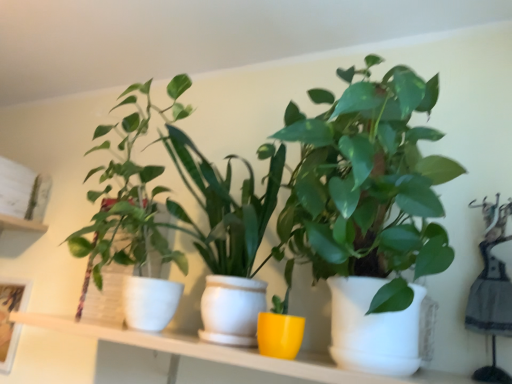
The width and height of the screenshot is (512, 384). What are the coordinates of `green matte plant at center, which is the first houseplant in right-to-left order` in the screenshot? It's located at (334, 190).

Where is `white ceramic shelf at center`? Image resolution: width=512 pixels, height=384 pixels. white ceramic shelf at center is located at coordinates (227, 352).

You are a GUI agent. You are given a task and a screenshot of the screen. Output one action in this format:
    pyautogui.click(x=<x>, y=<y>)
    Task: Click on the woven basket plant at left, the 1th houseplant viewed from the left
    The image size is (512, 384).
    Given the screenshot: What is the action you would take?
    pyautogui.click(x=128, y=196)

Locate an element on the screen. The width and height of the screenshot is (512, 384). green matte plant at center, which is the first houseplant in right-to-left order is located at coordinates (334, 190).

Considering the relative positions of white ceramic shelf at center and green matte plant at center, which is the 2th houseplant from left to right, in the image provided, is white ceramic shelf at center to the left or to the right of green matte plant at center, which is the 2th houseplant from left to right,?

From the image, it's evident that white ceramic shelf at center is to the left of green matte plant at center, which is the 2th houseplant from left to right.

Is white ceramic shelf at center placed right next to green matte plant at center, which is the first houseplant in right-to-left order?

white ceramic shelf at center and green matte plant at center, which is the first houseplant in right-to-left order, are clearly separated.

The height and width of the screenshot is (384, 512). What are the coordinates of `window sill behind the green matte plant at center, which is the first houseplant in right-to-left order` in the screenshot? It's located at (227, 352).

Locate an element on the screen. The image size is (512, 384). houseplant above the woven basket plant at left, the 1th houseplant viewed from the left (from a real-world perspective) is located at coordinates (334, 190).

Between green matte plant at center, which is the 2th houseplant from left to right, and woven basket plant at left, placed as the second houseplant when sorted from right to left, which one is positioned behind?

woven basket plant at left, placed as the second houseplant when sorted from right to left, is behind.

Is green matte plant at center, which is the first houseplant in right-to-left order, beside woven basket plant at left, the 1th houseplant viewed from the left?

No, green matte plant at center, which is the first houseplant in right-to-left order, is not making contact with woven basket plant at left, the 1th houseplant viewed from the left.

Can you tell me how much green matte plant at center, which is the 2th houseplant from left to right, and woven basket plant at left, the 1th houseplant viewed from the left, differ in facing direction?

They differ by 5.11 degrees in their facing directions.

From a real-world perspective, relative to white ceramic shelf at center, is green matte plant at center, which is the 2th houseplant from left to right, vertically above or below?

Clearly, from a real-world perspective, green matte plant at center, which is the 2th houseplant from left to right, is above white ceramic shelf at center.

I want to click on window sill directly beneath the green matte plant at center, which is the first houseplant in right-to-left order (from a real-world perspective), so coord(227,352).

Is green matte plant at center, which is the 2th houseplant from left to right, touching white ceramic shelf at center?

No.

Is green matte plant at center, which is the first houseplant in right-to-left order, wider or thinner than white ceramic shelf at center?

Considering their sizes, green matte plant at center, which is the first houseplant in right-to-left order, looks broader than white ceramic shelf at center.

Relative to white ceramic shelf at center, is woven basket plant at left, the 1th houseplant viewed from the left, in front or behind?

Visually, woven basket plant at left, the 1th houseplant viewed from the left, is located behind white ceramic shelf at center.

Is point (92, 242) positioned behind point (230, 354)?

Yes, it is behind point (230, 354).

Does woven basket plant at left, placed as the second houseplant when sorted from right to left, have a smaller size compared to white ceramic shelf at center?

Yes.

Who is taller, woven basket plant at left, the 1th houseplant viewed from the left, or white ceramic shelf at center?

woven basket plant at left, the 1th houseplant viewed from the left.

Is woven basket plant at left, placed as the second houseplant when sorted from right to left, turned away from green matte plant at center, which is the 2th houseplant from left to right?

woven basket plant at left, placed as the second houseplant when sorted from right to left, is not turned away from green matte plant at center, which is the 2th houseplant from left to right.

Considering the sizes of woven basket plant at left, the 1th houseplant viewed from the left, and green matte plant at center, which is the first houseplant in right-to-left order, in the image, is woven basket plant at left, the 1th houseplant viewed from the left, taller or shorter than green matte plant at center, which is the first houseplant in right-to-left order,?

In the image, woven basket plant at left, the 1th houseplant viewed from the left, appears to be shorter than green matte plant at center, which is the first houseplant in right-to-left order.

What's the angular difference between woven basket plant at left, the 1th houseplant viewed from the left, and green matte plant at center, which is the 2th houseplant from left to right,'s facing directions?

5.11 degrees.

Which is more to the right, white ceramic shelf at center or woven basket plant at left, placed as the second houseplant when sorted from right to left?

white ceramic shelf at center.

Is white ceramic shelf at center beside woven basket plant at left, placed as the second houseplant when sorted from right to left?

No, white ceramic shelf at center is not next to woven basket plant at left, placed as the second houseplant when sorted from right to left.

Considering the relative sizes of white ceramic shelf at center and woven basket plant at left, placed as the second houseplant when sorted from right to left, in the image provided, is white ceramic shelf at center taller than woven basket plant at left, placed as the second houseplant when sorted from right to left,?

In fact, white ceramic shelf at center may be shorter than woven basket plant at left, placed as the second houseplant when sorted from right to left.

Where is `houseplant located on the left of white ceramic shelf at center`? houseplant located on the left of white ceramic shelf at center is located at coordinates (128, 196).

Find the location of a particular element. This screenshot has width=512, height=384. window sill located below the green matte plant at center, which is the 2th houseplant from left to right (from the image's perspective) is located at coordinates (227, 352).

This screenshot has width=512, height=384. Identify the location of houseplant in front of the woven basket plant at left, the 1th houseplant viewed from the left. (334, 190).

Based on their spatial positions, is white ceramic shelf at center or woven basket plant at left, the 1th houseplant viewed from the left, closer to green matte plant at center, which is the 2th houseplant from left to right?

woven basket plant at left, the 1th houseplant viewed from the left, is closer to green matte plant at center, which is the 2th houseplant from left to right.

Looking at the image, which one is located closer to woven basket plant at left, placed as the second houseplant when sorted from right to left, white ceramic shelf at center or green matte plant at center, which is the 2th houseplant from left to right?

green matte plant at center, which is the 2th houseplant from left to right, lies closer to woven basket plant at left, placed as the second houseplant when sorted from right to left, than the other object.

Looking at the image, which one is located further to green matte plant at center, which is the first houseplant in right-to-left order, woven basket plant at left, the 1th houseplant viewed from the left, or white ceramic shelf at center?

Among the two, white ceramic shelf at center is located further to green matte plant at center, which is the first houseplant in right-to-left order.

Which object lies nearer to the anchor point white ceramic shelf at center, woven basket plant at left, placed as the second houseplant when sorted from right to left, or green matte plant at center, which is the 2th houseplant from left to right?

Among the two, green matte plant at center, which is the 2th houseplant from left to right, is located nearer to white ceramic shelf at center.

Considering their positions, is green matte plant at center, which is the first houseplant in right-to-left order, positioned closer to white ceramic shelf at center than woven basket plant at left, the 1th houseplant viewed from the left?

Based on the image, green matte plant at center, which is the first houseplant in right-to-left order, appears to be nearer to white ceramic shelf at center.

Looking at the image, which one is located further to woven basket plant at left, the 1th houseplant viewed from the left, green matte plant at center, which is the first houseplant in right-to-left order, or white ceramic shelf at center?

white ceramic shelf at center is positioned further to the anchor woven basket plant at left, the 1th houseplant viewed from the left.

This screenshot has width=512, height=384. Identify the location of houseplant between green matte plant at center, which is the 2th houseplant from left to right, and white ceramic shelf at center in the up-down direction. (128, 196).